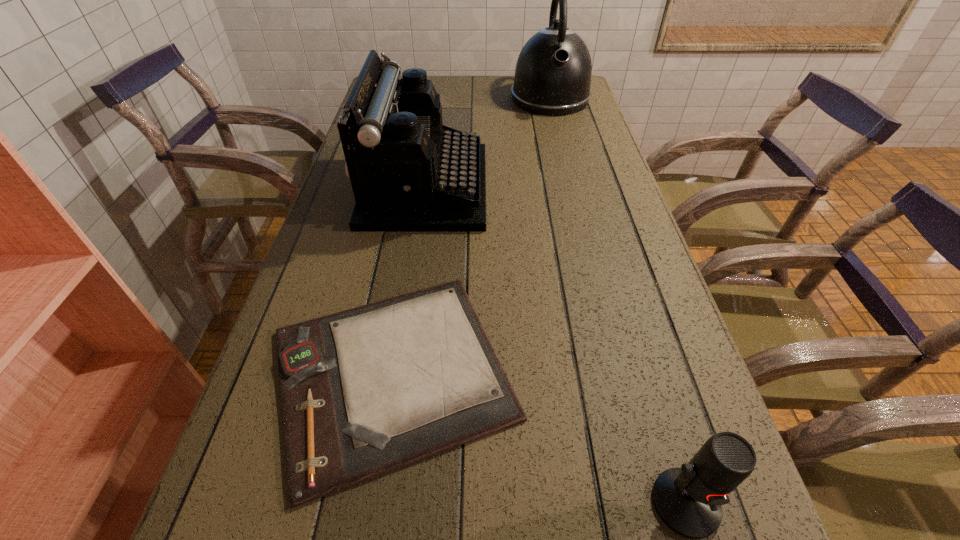
I want to click on kettle, so click(553, 72).

In order to click on the second farthest object in this screenshot , I will do `click(409, 172)`.

This screenshot has width=960, height=540. I want to click on microphone, so click(x=688, y=499).

This screenshot has height=540, width=960. I want to click on the shortest object, so click(365, 391).

This screenshot has height=540, width=960. Find the location of `vacant space positioned on the spout of the farthest object`. vacant space positioned on the spout of the farthest object is located at coordinates (561, 139).

At what (x,y) coordinates should I click in order to perform the action: click on vacant space located 0.100m on the typing side of the typewriter. Please return your answer as a coordinate pair (x, y). Looking at the image, I should click on (523, 187).

I want to click on vacant region located 0.050m on the back of the shortest object, so click(409, 266).

Image resolution: width=960 pixels, height=540 pixels. I want to click on object positioned at the far edge, so click(553, 72).

Where is `typewriter present at the left edge`? The width and height of the screenshot is (960, 540). typewriter present at the left edge is located at coordinates (409, 172).

You are a GUI agent. You are given a task and a screenshot of the screen. Output one action in this format:
    pyautogui.click(x=<x>, y=<y>)
    Task: Click on the clipboard located in the left edge section of the desktop
    The height and width of the screenshot is (540, 960).
    Given the screenshot: What is the action you would take?
    pyautogui.click(x=365, y=391)